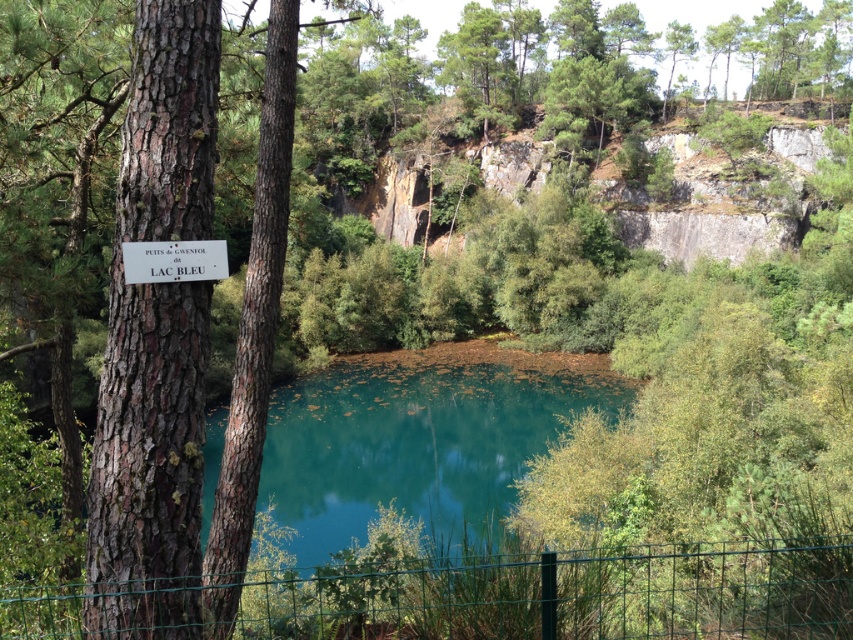
Between green wire mesh at lower center and white wooden sign at upper left, which one is positioned higher?

white wooden sign at upper left is higher up.

Which is below, green wire mesh at lower center or white wooden sign at upper left?

green wire mesh at lower center is lower down.

This screenshot has height=640, width=853. Describe the element at coordinates (480, 596) in the screenshot. I see `green wire mesh at lower center` at that location.

Where is `green wire mesh at lower center`? The image size is (853, 640). green wire mesh at lower center is located at coordinates (480, 596).

Between brown rough bark tree at left and white wooden sign at upper left, which one appears on the left side from the viewer's perspective?

brown rough bark tree at left is more to the left.

Looking at this image, does brown rough bark tree at left lie in front of white wooden sign at upper left?

Yes, brown rough bark tree at left is in front of white wooden sign at upper left.

Find the location of a particular element. This screenshot has width=853, height=640. brown rough bark tree at left is located at coordinates (155, 340).

Is green wire mesh at lower center positioned behind teal glossy water at center?

That is False.

Does point (740, 577) come closer to viewer compared to point (376, 365)?

Yes, it is in front of point (376, 365).

You are a GUI agent. You are given a task and a screenshot of the screen. Output one action in this format:
    pyautogui.click(x=<x>, y=<y>)
    Task: Click on the green wire mesh at lower center
    
    Given the screenshot: What is the action you would take?
    (x=480, y=596)